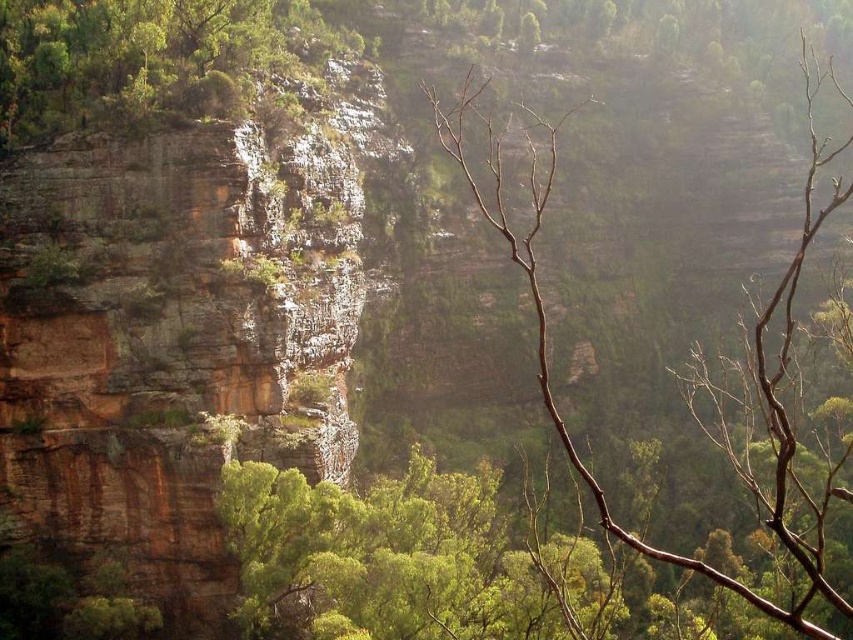
You are standing at the base of the cliff and looking towards the center of the image. There are two points marked in the scene. The first point is at coordinates point (x=4, y=435) and the second is at point (x=225, y=104). Which point is closer to you?

Point (x=4, y=435) is in front of point (x=225, y=104), so the first point is closer to you.

You are a hiker standing at the bottom of the rustic stone cliff at center and looking upward. You notice a green leafy shrub at upper left. In which direction relative to the shrub is the cliff located?

The rustic stone cliff at center is positioned under the green leafy shrub at upper left, so the cliff is directly below the shrub.

Based on the scene description, where is the rustic stone cliff at center located in terms of its 2D coordinates?

The rustic stone cliff at center is located at the 2D coordinates of point (177,340).